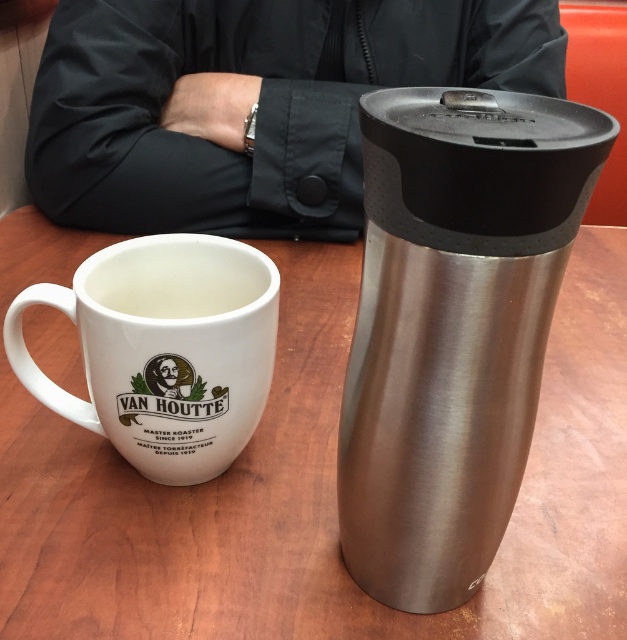
You are setting up a breakfast tray and need to choose a cup that can hold more liquid. Based on the image, which cup between the brushed metal thermos at right and the white ceramic mug at left should you select?

The brushed metal thermos at right has a greater height compared to the white ceramic mug at left, so it can hold more liquid.

You are a barista preparing drinks and need to place a taller object on the wooden table at center. Which object between the white ceramic mug at left and the stainless steel travel mug with a black lid on the right should you choose?

The wooden table at center is much taller than the white ceramic mug at left, so the stainless steel travel mug with a black lid on the right is the taller object and should be placed on the wooden table at center.

You are sitting at the wooden table at center and want to reach for the white ceramic mug at left. Is the mug within easy reach from your current position?

The wooden table at center is closer to the viewer than the white ceramic mug at left, so the mug is farther away and may not be within easy reach from your current position.